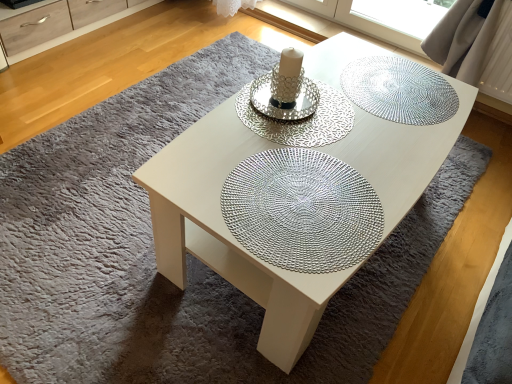
At what (x,y) coordinates should I click in order to perform the action: click on free spot above silver metallic doily at center, the 2th glass plate in the back-to-front sequence (from a real-world perspective). Please return your answer as a coordinate pair (x, y). Image resolution: width=512 pixels, height=384 pixels. Looking at the image, I should click on (306, 108).